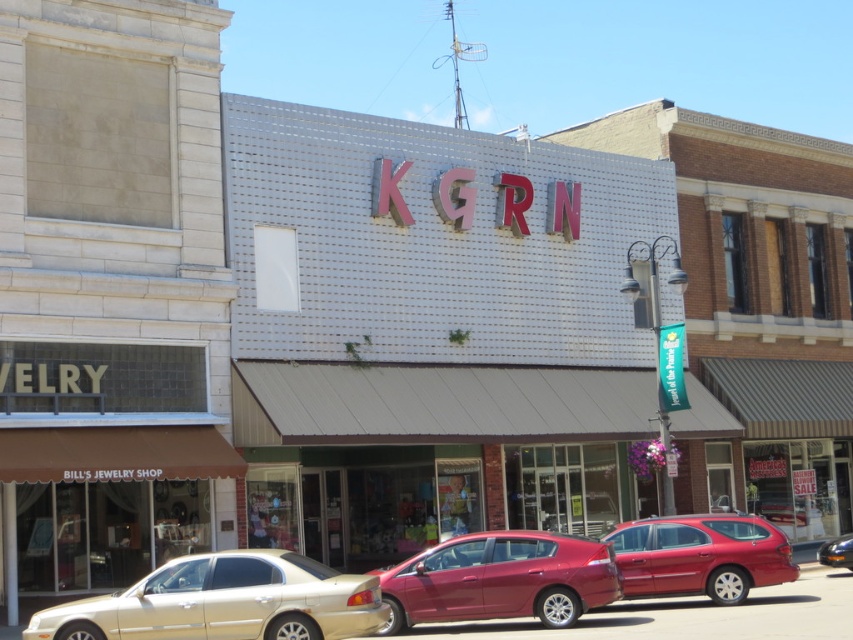
Question: Which point is closer to the camera?

Choices:
 (A) (120, 627)
 (B) (379, 582)
 (C) (828, 554)

Answer: (A)

Question: Is gold metallic sedan at lower left positioned in front of shiny black sedan at lower right?

Choices:
 (A) yes
 (B) no

Answer: (A)

Question: Is glossy red sedan at center thinner than shiny black sedan at lower right?

Choices:
 (A) yes
 (B) no

Answer: (A)

Question: Is metallic red station wagon at center below shiny black sedan at lower right?

Choices:
 (A) yes
 (B) no

Answer: (B)

Question: Which object appears closest to the camera in this image?

Choices:
 (A) metallic red station wagon at center
 (B) glossy red sedan at center

Answer: (B)

Question: Which point is closer to the camera?

Choices:
 (A) (466, 554)
 (B) (282, 554)
 (C) (828, 548)
 (D) (726, 516)

Answer: (B)